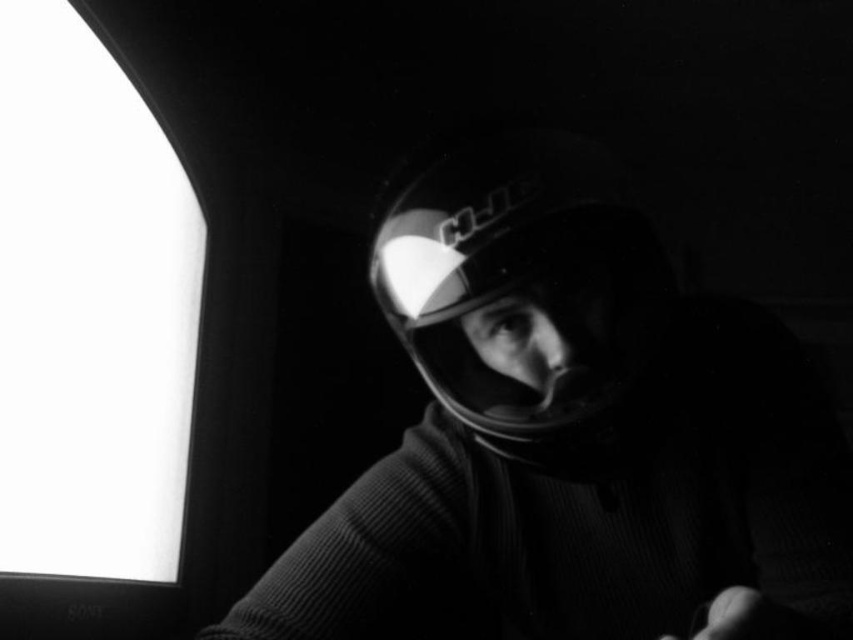
Can you confirm if white glossy computer monitor at left is positioned above glossy plastic helmet at center?

Actually, white glossy computer monitor at left is below glossy plastic helmet at center.

Is point (96, 45) positioned in front of point (628, 429)?

No, it is behind (628, 429).

Is point (189, 397) more distant than point (387, 243)?

Yes.

Find the location of a particular element. white glossy computer monitor at left is located at coordinates (90, 336).

Locate an element on the screen. matte black helmet at center is located at coordinates (572, 433).

Is matte black helmet at center bigger than glossy plastic helmet at center?

Yes, matte black helmet at center is bigger than glossy plastic helmet at center.

Find the location of a particular element. The height and width of the screenshot is (640, 853). matte black helmet at center is located at coordinates (572, 433).

Where is `matte black helmet at center`? This screenshot has width=853, height=640. matte black helmet at center is located at coordinates (572, 433).

Is matte black helmet at center thinner than white glossy computer monitor at left?

Incorrect, matte black helmet at center's width is not less than white glossy computer monitor at left's.

Looking at this image, who is taller, matte black helmet at center or white glossy computer monitor at left?

white glossy computer monitor at left

Identify the location of matte black helmet at center. (572, 433).

Find the location of a particular element. matte black helmet at center is located at coordinates (572, 433).